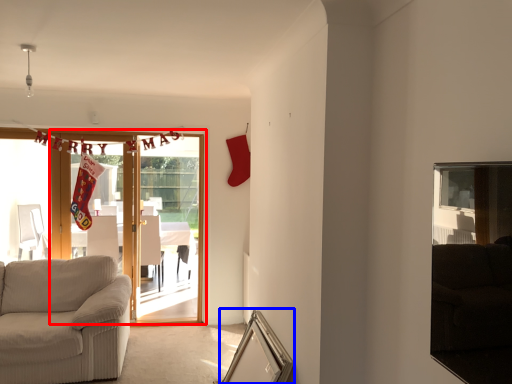
Question: Which of the following is the farthest to the observer, door (highlighted by a red box) or picture frame (highlighted by a blue box)?

Choices:
 (A) door
 (B) picture frame

Answer: (A)